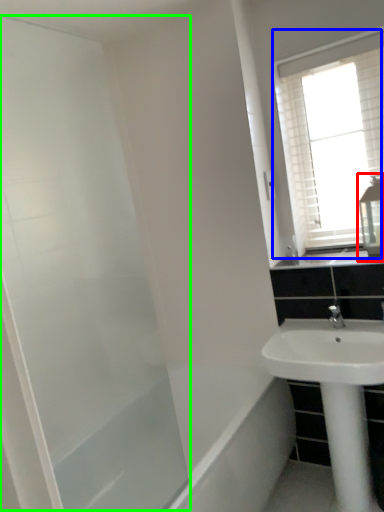
Question: Which object is the closest to the medicine cabinet (highlighted by a red box)? Choose among these: window (highlighted by a blue box) or screen door (highlighted by a green box).

Choices:
 (A) window
 (B) screen door

Answer: (A)